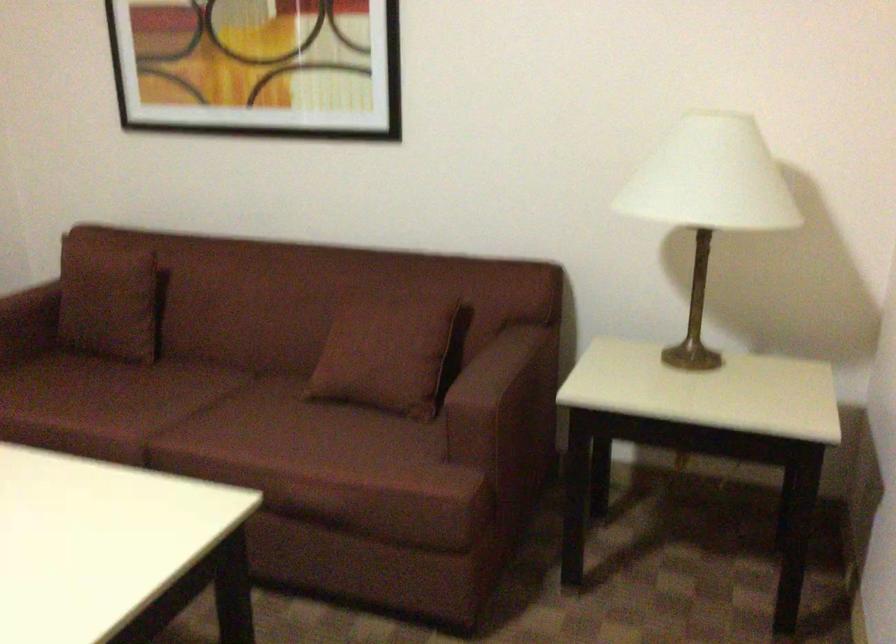
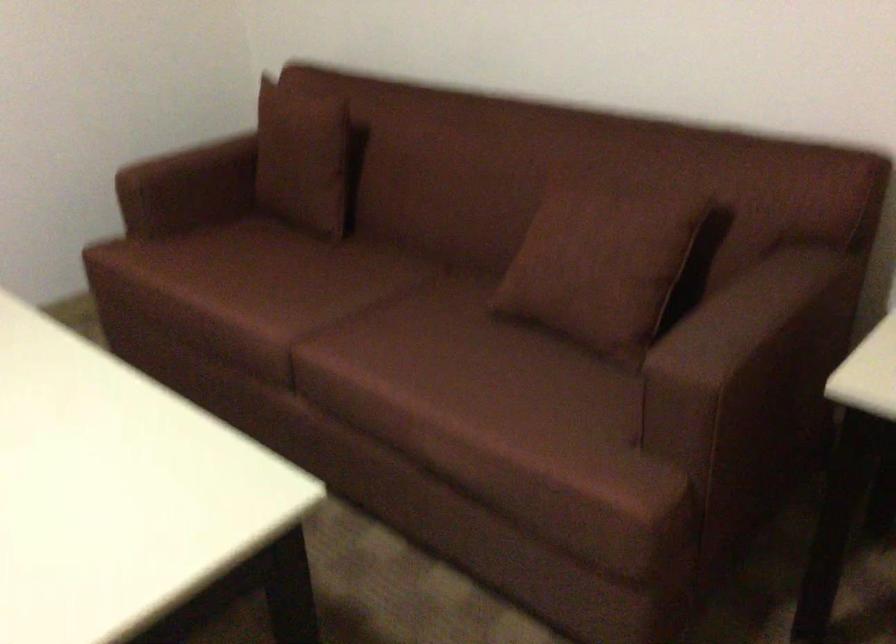
Find the pixel in the second image that matches point 392,346 in the first image.

(600, 263)